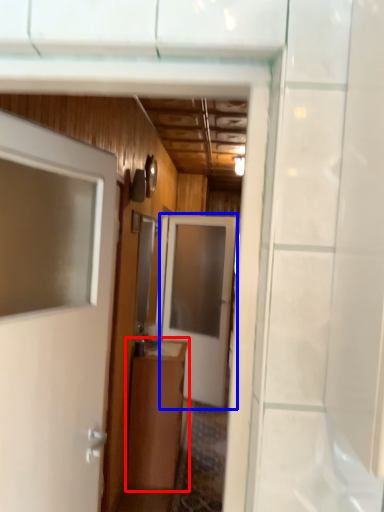
Question: Which object is further to the camera taking this photo, cabinetry (highlighted by a red box) or door (highlighted by a blue box)?

Choices:
 (A) cabinetry
 (B) door

Answer: (B)